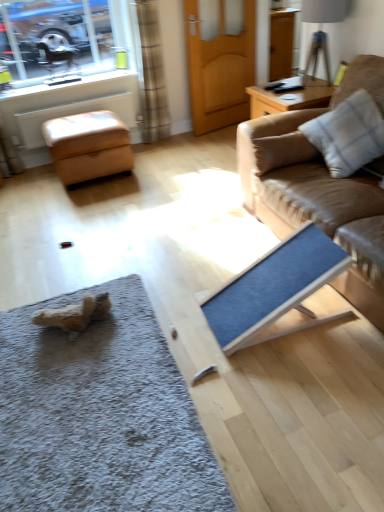
Where is `vacant space that's between leather ottoman at left and blue fabric yoga mat at center`? The width and height of the screenshot is (384, 512). vacant space that's between leather ottoman at left and blue fabric yoga mat at center is located at coordinates (160, 227).